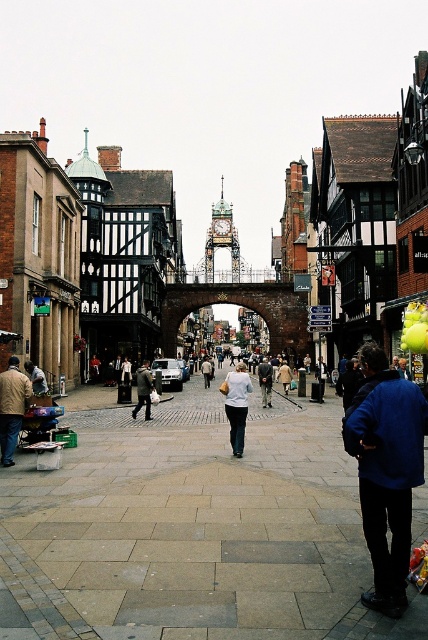
You are a shopper in the historic town center and see both the light beige sweater at center and the light brown leather jacket at lower left. Which item of clothing do you think has a bigger size?

The light beige sweater at center is larger in size than the light brown leather jacket at lower left, so the light beige sweater at center has a bigger size.

In the scene shown: You are a tailor in this historic town center and need to determine which garment is more suitable for a customer who prefers compact, easily foldable clothing. Based on the sizes of the light brown leather jacket at lower left and the white cotton shirt at center, which one would you recommend?

The light brown leather jacket at lower left is smaller than the white cotton shirt at center, so it would be more suitable for a customer who prefers compact, easily foldable clothing.

Looking at this image, you are standing in the historic town center and notice a light brown leather jacket at lower left. Where exactly is the light brown leather jacket located in relation to the other objects in the scene?

The light brown leather jacket at lower left is located at point coordinates of (35, 378).